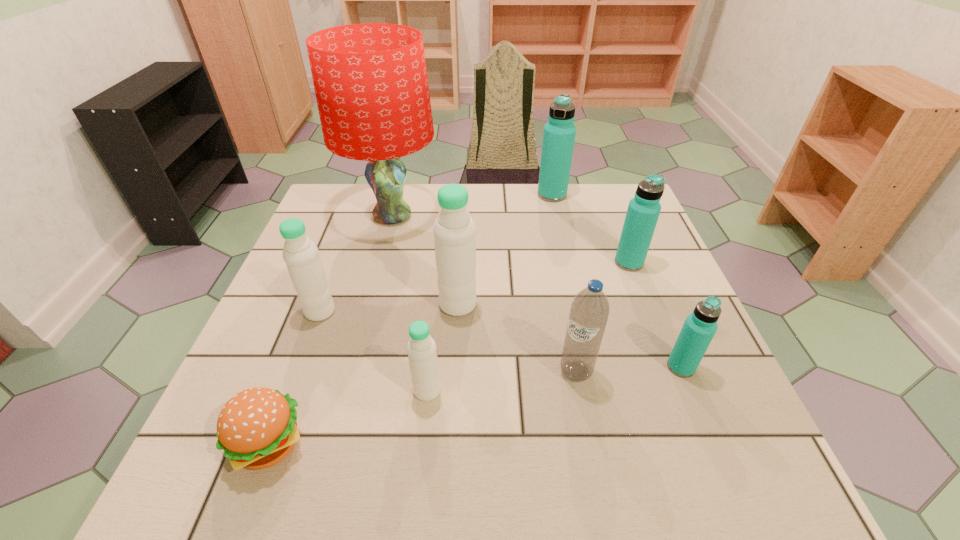
Locate an element on the screen. The height and width of the screenshot is (540, 960). free space between the farthest water bottle and the tallest object is located at coordinates (472, 205).

You are a GUI agent. You are given a task and a screenshot of the screen. Output one action in this format:
    pyautogui.click(x=<x>, y=<y>)
    Task: Click on the free space between the leftmost water bottle and the nearest object
    This screenshot has height=540, width=960.
    Given the screenshot: What is the action you would take?
    pyautogui.click(x=295, y=378)

You are a GUI agent. You are given a task and a screenshot of the screen. Output one action in this format:
    pyautogui.click(x=<x>, y=<y>)
    Task: Click on the closest object to the smallest blue water bottle
    
    Given the screenshot: What is the action you would take?
    pyautogui.click(x=589, y=312)

The width and height of the screenshot is (960, 540). I want to click on object that stands as the seventh closest to the smallest blue water bottle, so coord(257,428).

Point out which water bottle is positioned as the fourth nearest to the biggest white water bottle. Please provide its 2D coordinates. Your answer should be formatted as a tuple, i.e. [(x, y)], where the tuple contains the x and y coordinates of a point satisfying the conditions above.

[(643, 211)]

Locate an element on the screen. The image size is (960, 540). the sixth closest water bottle to the farthest water bottle is located at coordinates (421, 349).

Select which blue water bottle appears as the third closest to the biggest white water bottle. Please provide its 2D coordinates. Your answer should be formatted as a tuple, i.e. [(x, y)], where the tuple contains the x and y coordinates of a point satisfying the conditions above.

[(699, 328)]

Identify which blue water bottle is the nearest to the hamburger. Please provide its 2D coordinates. Your answer should be formatted as a tuple, i.e. [(x, y)], where the tuple contains the x and y coordinates of a point satisfying the conditions above.

[(589, 312)]

Identify which white water bottle is the nearest to the sixth nearest water bottle. Please provide its 2D coordinates. Your answer should be formatted as a tuple, i.e. [(x, y)], where the tuple contains the x and y coordinates of a point satisfying the conditions above.

[(454, 230)]

Choose which white water bottle is the second nearest neighbor to the farthest water bottle. Please provide its 2D coordinates. Your answer should be formatted as a tuple, i.e. [(x, y)], where the tuple contains the x and y coordinates of a point satisfying the conditions above.

[(304, 265)]